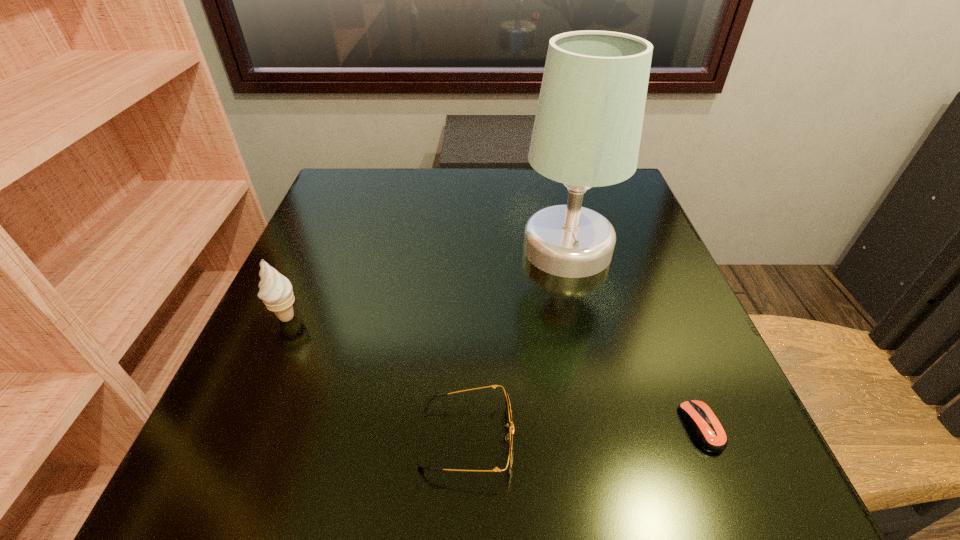
I want to click on the tallest object, so click(x=587, y=130).

Locate an element on the screen. the farthest object is located at coordinates (587, 130).

Where is `the third shortest object`? This screenshot has width=960, height=540. the third shortest object is located at coordinates click(276, 292).

Where is `the third nearest object`? Image resolution: width=960 pixels, height=540 pixels. the third nearest object is located at coordinates (276, 292).

Where is `the second object from left to right`? Image resolution: width=960 pixels, height=540 pixels. the second object from left to right is located at coordinates (510, 440).

Locate an element on the screen. The width and height of the screenshot is (960, 540). sunglasses is located at coordinates (510, 440).

The height and width of the screenshot is (540, 960). I want to click on the shortest object, so click(707, 430).

Identify the location of computer mouse. The height and width of the screenshot is (540, 960). (707, 430).

You are a GUI agent. You are given a task and a screenshot of the screen. Output one action in this format:
    pyautogui.click(x=<x>, y=<y>)
    Task: Click on the vacant space located 0.160m on the base of the tallest object
    
    Given the screenshot: What is the action you would take?
    pyautogui.click(x=446, y=248)

Where is `vacant region located on the base of the tallest object`? The image size is (960, 540). vacant region located on the base of the tallest object is located at coordinates (498, 248).